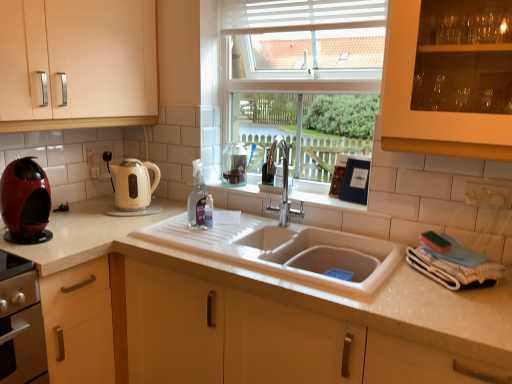
How much space does shiny red coffee machine at left, acting as the second kitchen appliance starting from the back, occupy vertically?

It is 12.83 inches.

At what (x,y) coordinates should I click in order to perform the action: click on matte cream cabinet at left. Please return your answer as a coordinate pair (x, y). The height and width of the screenshot is (384, 512). Looking at the image, I should click on (78, 63).

What is the approximate height of matte cream cabinet at left?

The height of matte cream cabinet at left is 65.31 centimeters.

Find the location of a particular element. The width and height of the screenshot is (512, 384). clear glass spray bottle at center is located at coordinates (197, 197).

The height and width of the screenshot is (384, 512). What do you see at coordinates (134, 185) in the screenshot?
I see `cream matte electric kettle at left, which is the 1th kitchen appliance from back to front` at bounding box center [134, 185].

The image size is (512, 384). Describe the element at coordinates (298, 15) in the screenshot. I see `white plastic blinds at upper center` at that location.

Locate an element on the screen. shiny red coffee machine at left, acting as the second kitchen appliance starting from the back is located at coordinates (25, 202).

Is matte cream cabinet at left positioned before white plastic blinds at upper center?

Yes, it is in front of white plastic blinds at upper center.

Can you confirm if matte cream cabinet at left is positioned to the left of white plastic blinds at upper center?

Indeed, matte cream cabinet at left is positioned on the left side of white plastic blinds at upper center.

Which is correct: matte cream cabinet at left is inside white plastic blinds at upper center, or outside of it?

matte cream cabinet at left lies outside white plastic blinds at upper center.

From a real-world perspective, who is located lower, matte cream cabinet at left or white plastic blinds at upper center?

matte cream cabinet at left.

Consider the image. From a real-world perspective, relative to clear glass spray bottle at center, is matte cream cabinet at left vertically above or below?

matte cream cabinet at left is above clear glass spray bottle at center.

Who is taller, matte cream cabinet at left or clear glass spray bottle at center?

matte cream cabinet at left.

Identify the location of bottle below the matte cream cabinet at left (from a real-world perspective). The height and width of the screenshot is (384, 512). (197, 197).

Is matte cream cabinet at left closer to the viewer compared to clear glass spray bottle at center?

Yes, matte cream cabinet at left is closer to the camera.

How far apart are clear glass spray bottle at center and white plastic blinds at upper center?

37.91 inches.

Does clear glass spray bottle at center have a smaller size compared to white plastic blinds at upper center?

Yes.

Is clear glass spray bottle at center not close to white plastic blinds at upper center?

No, clear glass spray bottle at center is not far away from white plastic blinds at upper center.

Is clear glass spray bottle at center positioned behind white plastic blinds at upper center?

Yes.

Looking at this image, considering the relative positions of clear glass spray bottle at center and white glossy countertop at center in the image provided, is clear glass spray bottle at center to the left of white glossy countertop at center from the viewer's perspective?

Yes.

Is clear glass spray bottle at center oriented towards white glossy countertop at center?

No, clear glass spray bottle at center does not turn towards white glossy countertop at center.

From a real-world perspective, between clear glass spray bottle at center and white glossy countertop at center, who is vertically lower?

From a 3D spatial view, white glossy countertop at center is below.

From a real-world perspective, does shiny red coffee machine at left, which is the first kitchen appliance from front to back, sit lower than clear glass spray bottle at center?

Correct, in the physical world, shiny red coffee machine at left, which is the first kitchen appliance from front to back, is lower than clear glass spray bottle at center.

From the picture: Is shiny red coffee machine at left, which is the 2th kitchen appliance in right-to-left order, completely or partially outside of clear glass spray bottle at center?

Yes, shiny red coffee machine at left, which is the 2th kitchen appliance in right-to-left order, is not within clear glass spray bottle at center.

Considering the relative sizes of shiny red coffee machine at left, which is the 2th kitchen appliance in right-to-left order, and clear glass spray bottle at center in the image provided, is shiny red coffee machine at left, which is the 2th kitchen appliance in right-to-left order, thinner than clear glass spray bottle at center?

In fact, shiny red coffee machine at left, which is the 2th kitchen appliance in right-to-left order, might be wider than clear glass spray bottle at center.

Can you confirm if shiny red coffee machine at left, which is the 2th kitchen appliance in right-to-left order, is positioned to the right of clear glass spray bottle at center?

In fact, shiny red coffee machine at left, which is the 2th kitchen appliance in right-to-left order, is to the left of clear glass spray bottle at center.

Is shiny red coffee machine at left, which is the first kitchen appliance from front to back, wider than white glossy countertop at center?

Incorrect, the width of shiny red coffee machine at left, which is the first kitchen appliance from front to back, does not surpass that of white glossy countertop at center.

Who is more distant, shiny red coffee machine at left, which is the 2th kitchen appliance in right-to-left order, or white glossy countertop at center?

shiny red coffee machine at left, which is the 2th kitchen appliance in right-to-left order, is more distant.

Is shiny red coffee machine at left, which is the first kitchen appliance from front to back, facing away from white glossy countertop at center?

That's not correct — shiny red coffee machine at left, which is the first kitchen appliance from front to back, is not looking away from white glossy countertop at center.

Which point is more forward, (24, 209) or (59, 236)?

Positioned in front is point (24, 209).

From a real-world perspective, is cream matte electric kettle at left, the second kitchen appliance from the left, below white plastic blinds at upper center?

Yes, from a real-world perspective, cream matte electric kettle at left, the second kitchen appliance from the left, is under white plastic blinds at upper center.

Does cream matte electric kettle at left, the second kitchen appliance from the left, have a smaller size compared to white plastic blinds at upper center?

Yes, cream matte electric kettle at left, the second kitchen appliance from the left, is smaller than white plastic blinds at upper center.

You are a GUI agent. You are given a task and a screenshot of the screen. Output one action in this format:
    pyautogui.click(x=<x>, y=<y>)
    Task: Click on the kitchen appliance behind the white plastic blinds at upper center
    This screenshot has width=512, height=384.
    Given the screenshot: What is the action you would take?
    pyautogui.click(x=134, y=185)

Is point (143, 172) closer or farther from the camera than point (245, 14)?

Point (143, 172) is positioned closer to the camera compared to point (245, 14).

Where is `shutter on the right of matte cream cabinet at left`? This screenshot has width=512, height=384. shutter on the right of matte cream cabinet at left is located at coordinates (298, 15).

Locate an element on the screen. bottle below the matte cream cabinet at left (from a real-world perspective) is located at coordinates (197, 197).

Estimate the real-world distances between objects in this image. Which object is closer to white glossy countertop at center, matte cream cabinet at left or cream matte electric kettle at left, the second kitchen appliance from the left?

cream matte electric kettle at left, the second kitchen appliance from the left, lies closer to white glossy countertop at center than the other object.

Based on their spatial positions, is cream matte electric kettle at left, which is the 2th kitchen appliance in front-to-back order, or clear glass spray bottle at center further from white glossy countertop at center?

Among the two, clear glass spray bottle at center is located further to white glossy countertop at center.

Looking at this image, based on their spatial positions, is white glossy countertop at center or clear glass spray bottle at center closer to white plastic blinds at upper center?

clear glass spray bottle at center lies closer to white plastic blinds at upper center than the other object.

Which object lies further to the anchor point white glossy countertop at center, shiny red coffee machine at left, which is the first kitchen appliance from front to back, or clear glass spray bottle at center?

clear glass spray bottle at center is positioned further to the anchor white glossy countertop at center.

Looking at the image, which one is located closer to white plastic blinds at upper center, clear glass spray bottle at center or matte cream cabinet at left?

matte cream cabinet at left.

From the image, which object appears to be farther from clear glass spray bottle at center, matte cream cabinet at left or white glossy countertop at center?

matte cream cabinet at left.

From the image, which object appears to be nearer to white glossy countertop at center, shiny red coffee machine at left, acting as the second kitchen appliance starting from the back, or cream matte electric kettle at left, which is the 1th kitchen appliance from back to front?

shiny red coffee machine at left, acting as the second kitchen appliance starting from the back.

Considering their positions, is white plastic blinds at upper center positioned closer to matte cream cabinet at left than white glossy countertop at center?

white plastic blinds at upper center is positioned closer to the anchor matte cream cabinet at left.

You are a GUI agent. You are given a task and a screenshot of the screen. Output one action in this format:
    pyautogui.click(x=<x>, y=<y>)
    Task: Click on the cabinetry between shiny red coffee machine at left, which is the 2th kitchen appliance in right-to-left order, and clear glass spray bottle at center
    The height and width of the screenshot is (384, 512).
    Given the screenshot: What is the action you would take?
    pyautogui.click(x=78, y=63)

This screenshot has width=512, height=384. Find the location of `kitchen appliance between white plastic blinds at upper center and clear glass spray bottle at center vertically`. kitchen appliance between white plastic blinds at upper center and clear glass spray bottle at center vertically is located at coordinates (134, 185).

Where is `bottle that lies between white plastic blinds at upper center and white glossy countertop at center from top to bottom`? This screenshot has width=512, height=384. bottle that lies between white plastic blinds at upper center and white glossy countertop at center from top to bottom is located at coordinates (197, 197).

Find the location of a particular element. The image size is (512, 384). kitchen appliance between shiny red coffee machine at left, which is the first kitchen appliance from front to back, and clear glass spray bottle at center is located at coordinates (134, 185).